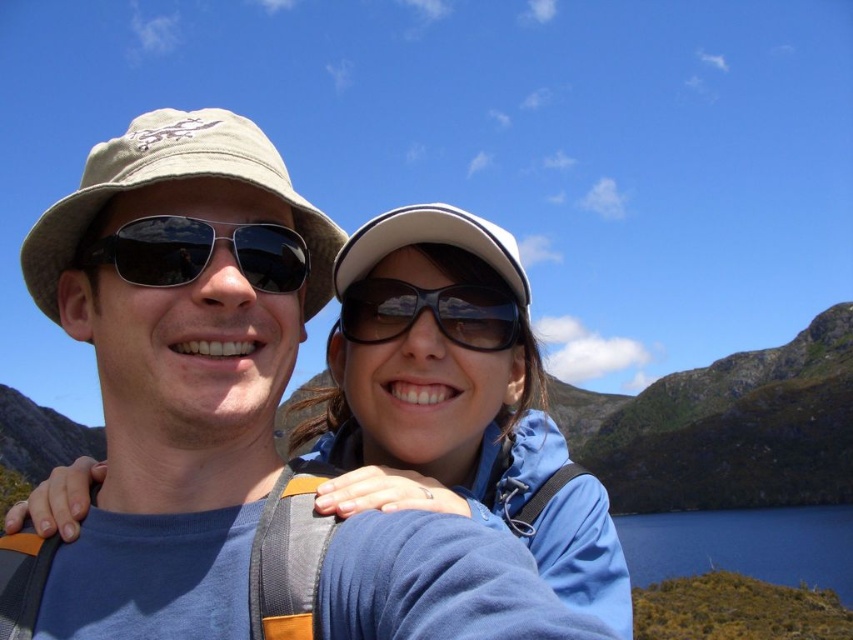
Question: Can you confirm if khaki fabric hat at left is bigger than black plastic sunglasses at center?

Choices:
 (A) yes
 (B) no

Answer: (A)

Question: Which of the following is the farthest from the observer?

Choices:
 (A) black plastic sunglasses at center
 (B) white fabric cap at upper center
 (C) matte black sunglasses at center
 (D) khaki fabric hat at left

Answer: (A)

Question: Can you confirm if khaki fabric hat at left is positioned below matte black sunglasses at center?

Choices:
 (A) yes
 (B) no

Answer: (B)

Question: Which point is farther to the camera?

Choices:
 (A) khaki fabric hat at left
 (B) white fabric cap at upper center
 (C) matte black sunglasses at center
 (D) black plastic sunglasses at center

Answer: (D)

Question: Does matte blue jacket at center appear under black plastic sunglasses at center?

Choices:
 (A) yes
 (B) no

Answer: (A)

Question: Which object is farther from the camera taking this photo?

Choices:
 (A) matte blue jacket at center
 (B) matte black sunglasses at center
 (C) black plastic sunglasses at center

Answer: (C)